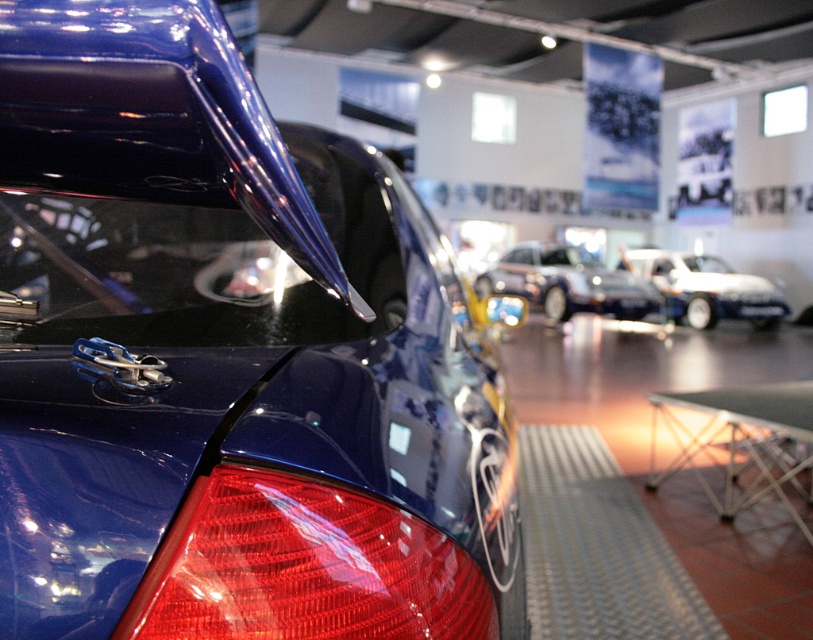
Question: Does glossy blue spoiler at upper left appear on the left side of black plastic license plate at center?

Choices:
 (A) no
 (B) yes

Answer: (B)

Question: Considering the real-world distances, which object is closest to the red translucent tail light at lower right?

Choices:
 (A) black plastic license plate at center
 (B) glossy blue spoiler at upper left
 (C) white glossy car at center
 (D) shiny metallic car at center

Answer: (B)

Question: Among these points, which one is farthest from the camera?

Choices:
 (A) (677, 252)
 (B) (776, 314)
 (C) (576, 273)
 (D) (303, 225)

Answer: (A)

Question: Which object is positioned closest to the glossy blue spoiler at upper left?

Choices:
 (A) shiny metallic car at center
 (B) red translucent tail light at lower right
 (C) black plastic license plate at center

Answer: (B)

Question: In this image, where is red translucent tail light at lower right located relative to black plastic license plate at center?

Choices:
 (A) left
 (B) right

Answer: (A)

Question: Considering the relative positions of shiny metallic car at center and black plastic license plate at center in the image provided, where is shiny metallic car at center located with respect to black plastic license plate at center?

Choices:
 (A) below
 (B) above

Answer: (B)